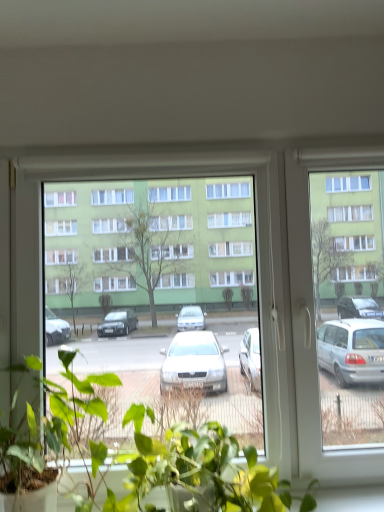
What is the approximate width of transparent glass window at center?

transparent glass window at center is 4.27 inches in width.

In order to click on green leafy plant at lower center, which is the first houseplant in right-to-left order in this screenshot , I will do `click(168, 457)`.

Does green matte plant at center, which appears as the first houseplant when viewed from the left, come in front of green leafy plant at lower center, the second houseplant viewed from the left?

Yes, green matte plant at center, which appears as the first houseplant when viewed from the left, is closer to the viewer.

Consider the image. Does green matte plant at center, which appears as the first houseplant when viewed from the left, contain green leafy plant at lower center, the second houseplant viewed from the left?

Definitely not — green leafy plant at lower center, the second houseplant viewed from the left, is not inside green matte plant at center, which appears as the first houseplant when viewed from the left.

Is point (32, 473) positioned behind point (78, 404)?

No, it is in front of (78, 404).

How different are the orientations of green leafy plant at lower center, which is the first houseplant in right-to-left order, and transparent glass window at center in degrees?

The angle between the facing direction of green leafy plant at lower center, which is the first houseplant in right-to-left order, and the facing direction of transparent glass window at center is 0.571 degrees.

Where is `the 1st houseplant in front of the transparent glass window at center, starting your count from the anchor`? The width and height of the screenshot is (384, 512). the 1st houseplant in front of the transparent glass window at center, starting your count from the anchor is located at coordinates (168, 457).

Between point (257, 498) and point (276, 444), which one is positioned behind?

The point (276, 444) is behind.

How many degrees apart are the facing directions of transparent glass window at center and green leafy plant at lower center, the second houseplant viewed from the left?

0.571 degrees separate the facing orientations of transparent glass window at center and green leafy plant at lower center, the second houseplant viewed from the left.

Is transparent glass window at center taller or shorter than green leafy plant at lower center, the second houseplant viewed from the left?

Clearly, transparent glass window at center is taller compared to green leafy plant at lower center, the second houseplant viewed from the left.

Considering the sizes of objects transparent glass window at center and green leafy plant at lower center, the second houseplant viewed from the left, in the image provided, who is wider, transparent glass window at center or green leafy plant at lower center, the second houseplant viewed from the left,?

green leafy plant at lower center, the second houseplant viewed from the left, is wider.

Based on the photo, does green leafy plant at lower center, the second houseplant viewed from the left, appear on the left side of green matte plant at center, acting as the second houseplant starting from the right?

No, green leafy plant at lower center, the second houseplant viewed from the left, is not to the left of green matte plant at center, acting as the second houseplant starting from the right.

Considering the points (147, 413) and (44, 473), which point is behind, point (147, 413) or point (44, 473)?

The point (147, 413) is farther from the camera.

In the scene shown: Is green leafy plant at lower center, the second houseplant viewed from the left, positioned before green matte plant at center, acting as the second houseplant starting from the right?

No.

What's the angular difference between green leafy plant at lower center, the second houseplant viewed from the left, and green matte plant at center, which appears as the first houseplant when viewed from the left,'s facing directions?

The angle between the facing direction of green leafy plant at lower center, the second houseplant viewed from the left, and the facing direction of green matte plant at center, which appears as the first houseplant when viewed from the left, is 0.000107 degrees.

Does green matte plant at center, acting as the second houseplant starting from the right, have a larger size compared to transparent glass window at center?

Actually, green matte plant at center, acting as the second houseplant starting from the right, might be smaller than transparent glass window at center.

Which of these two, green matte plant at center, acting as the second houseplant starting from the right, or transparent glass window at center, stands shorter?

With less height is green matte plant at center, acting as the second houseplant starting from the right.

Which is behind, green matte plant at center, which appears as the first houseplant when viewed from the left, or transparent glass window at center?

transparent glass window at center is further away from the camera.

From a real-world perspective, between green matte plant at center, which appears as the first houseplant when viewed from the left, and transparent glass window at center, who is vertically higher?

In real-world perspective, transparent glass window at center is above.

Where is `the 2nd houseplant in front when counting from the transparent glass window at center`? the 2nd houseplant in front when counting from the transparent glass window at center is located at coordinates (72, 404).

From a real-world perspective, is transparent glass window at center physically located above or below green matte plant at center, acting as the second houseplant starting from the right?

transparent glass window at center is situated higher than green matte plant at center, acting as the second houseplant starting from the right, in the real world.

Consider the image. From the image's perspective, between transparent glass window at center and green matte plant at center, which appears as the first houseplant when viewed from the left, which one is located above?

transparent glass window at center.

Can you tell me how much transparent glass window at center and green matte plant at center, which appears as the first houseplant when viewed from the left, differ in facing direction?

transparent glass window at center and green matte plant at center, which appears as the first houseplant when viewed from the left, are facing 0.571 degrees away from each other.

This screenshot has width=384, height=512. What are the coordinates of `houseplant above the green leafy plant at lower center, which is the first houseplant in right-to-left order (from a real-world perspective)` in the screenshot? It's located at (72, 404).

From a real-world perspective, which houseplant is the 2nd one underneath the transparent glass window at center? Please provide its 2D coordinates.

[(168, 457)]

Looking at the image, which one is located closer to green leafy plant at lower center, which is the first houseplant in right-to-left order, green matte plant at center, which appears as the first houseplant when viewed from the left, or transparent glass window at center?

green matte plant at center, which appears as the first houseplant when viewed from the left, lies closer to green leafy plant at lower center, which is the first houseplant in right-to-left order, than the other object.

Which object lies further to the anchor point transparent glass window at center, green leafy plant at lower center, the second houseplant viewed from the left, or green matte plant at center, acting as the second houseplant starting from the right?

green matte plant at center, acting as the second houseplant starting from the right.

Based on their spatial positions, is green leafy plant at lower center, the second houseplant viewed from the left, or transparent glass window at center further from green matte plant at center, which appears as the first houseplant when viewed from the left?

transparent glass window at center is positioned further to the anchor green matte plant at center, which appears as the first houseplant when viewed from the left.

Which object lies nearer to the anchor point transparent glass window at center, green matte plant at center, acting as the second houseplant starting from the right, or green leafy plant at lower center, the second houseplant viewed from the left?

The object closer to transparent glass window at center is green leafy plant at lower center, the second houseplant viewed from the left.

Estimate the real-world distances between objects in this image. Which object is closer to green leafy plant at lower center, which is the first houseplant in right-to-left order, transparent glass window at center or green matte plant at center, which appears as the first houseplant when viewed from the left?

Among the two, green matte plant at center, which appears as the first houseplant when viewed from the left, is located nearer to green leafy plant at lower center, which is the first houseplant in right-to-left order.

Based on their spatial positions, is transparent glass window at center or green leafy plant at lower center, which is the first houseplant in right-to-left order, closer to green matte plant at center, which appears as the first houseplant when viewed from the left?

green leafy plant at lower center, which is the first houseplant in right-to-left order, is positioned closer to the anchor green matte plant at center, which appears as the first houseplant when viewed from the left.

You are a GUI agent. You are given a task and a screenshot of the screen. Output one action in this format:
    pyautogui.click(x=<x>, y=<y>)
    Task: Click on the houseplant located between green matte plant at center, acting as the second houseplant starting from the right, and transparent glass window at center in the left-right direction
    This screenshot has width=384, height=512.
    Given the screenshot: What is the action you would take?
    (x=168, y=457)